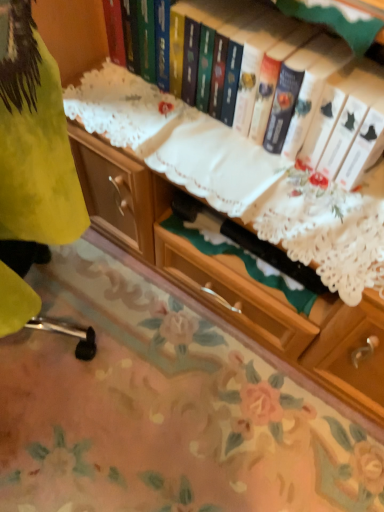
What are the coordinates of `free point above floral-patterned fabric at lower center (from a real-world perspective)` in the screenshot? It's located at (125, 380).